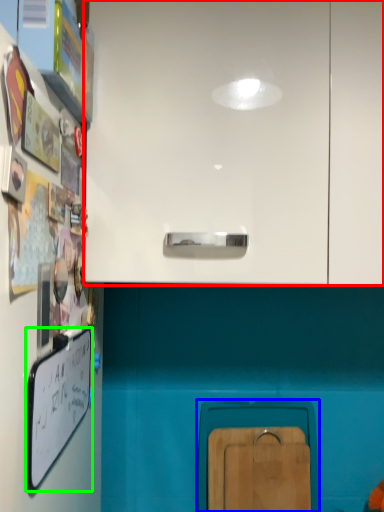
Question: Which is nearer to the cabinetry (highlighted by a red box)? cabinetry (highlighted by a blue box) or whiteboard (highlighted by a green box).

Choices:
 (A) cabinetry
 (B) whiteboard

Answer: (B)